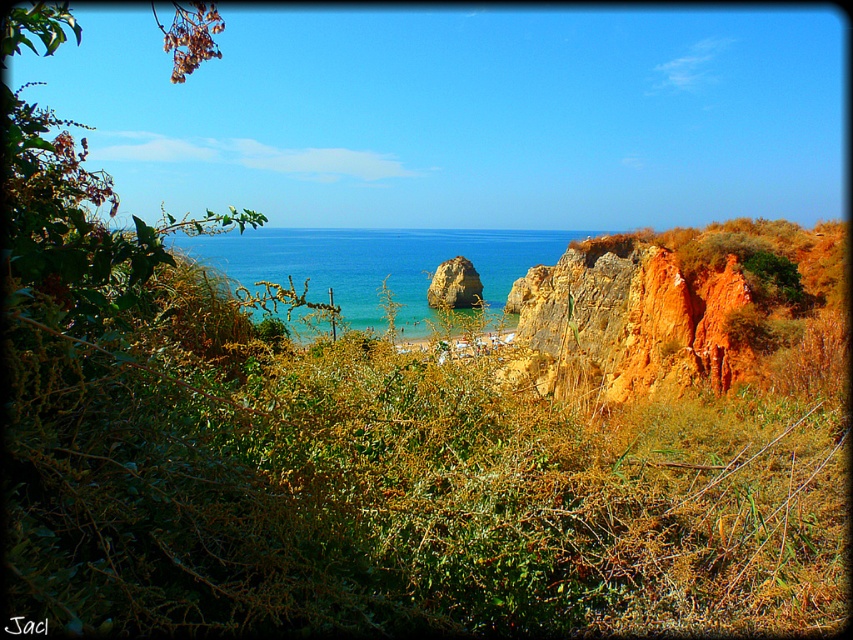
Which is behind, point (410, 323) or point (438, 288)?

The point (410, 323) is behind.

Does blue clear water at center have a greater height compared to orange rock at center?

Indeed, blue clear water at center has a greater height compared to orange rock at center.

The width and height of the screenshot is (853, 640). I want to click on blue clear water at center, so click(375, 264).